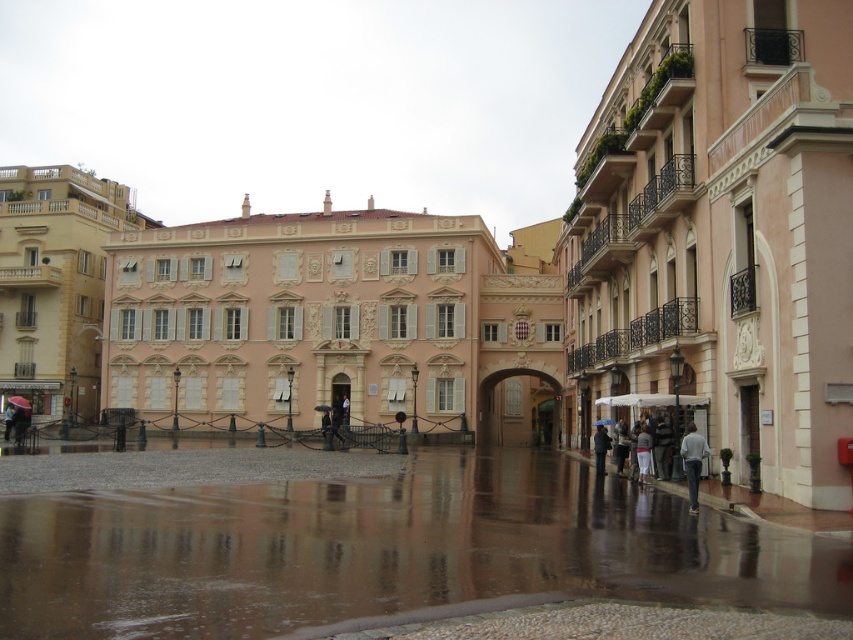
Question: Can you confirm if matte beige building at left is positioned to the right of dark gray fabric umbrella at lower right?

Choices:
 (A) no
 (B) yes

Answer: (A)

Question: Which point is closer to the camera?

Choices:
 (A) matte pink building at right
 (B) gray fabric jacket at lower right
 (C) transparent plastic umbrella at center
 (D) matte pink building at center

Answer: (A)

Question: Does glossy concrete pavement at center have a smaller size compared to gray cotton sweater at lower right?

Choices:
 (A) no
 (B) yes

Answer: (A)

Question: Among these points, which one is farthest from the camera?

Choices:
 (A) (705, 440)
 (B) (566, 224)
 (C) (660, 422)

Answer: (B)

Question: Among these objects, which one is nearest to the camera?

Choices:
 (A) glossy concrete pavement at center
 (B) matte black umbrella at lower left

Answer: (A)

Question: Is gray cotton sweater at lower right above matte black umbrella at lower left?

Choices:
 (A) no
 (B) yes

Answer: (B)